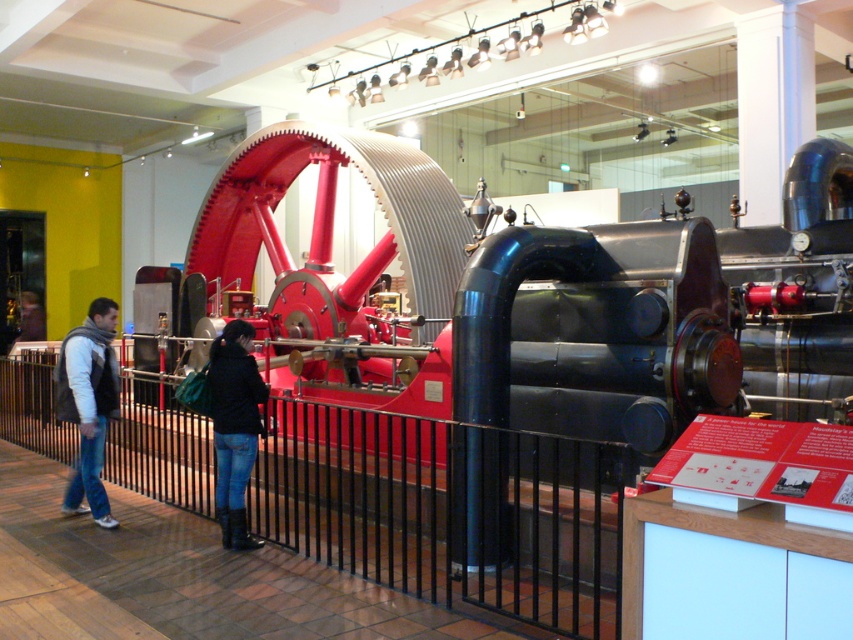
Question: Does red polished metal steam engine at center have a larger size compared to jeans at lower center?

Choices:
 (A) no
 (B) yes

Answer: (B)

Question: Which object is the farthest from the denim jacket at left?

Choices:
 (A) jeans at lower center
 (B) red polished metal steam engine at center

Answer: (B)

Question: Which of these objects is positioned closest to the jeans at lower center?

Choices:
 (A) denim jacket at left
 (B) red polished metal steam engine at center

Answer: (A)

Question: Considering the relative positions of red polished metal steam engine at center and jeans at lower center in the image provided, where is red polished metal steam engine at center located with respect to jeans at lower center?

Choices:
 (A) below
 (B) above

Answer: (B)

Question: Considering the real-world distances, which object is farthest from the denim jacket at left?

Choices:
 (A) jeans at lower center
 (B) red polished metal steam engine at center

Answer: (B)

Question: Is red polished metal steam engine at center wider than denim jacket at left?

Choices:
 (A) yes
 (B) no

Answer: (A)